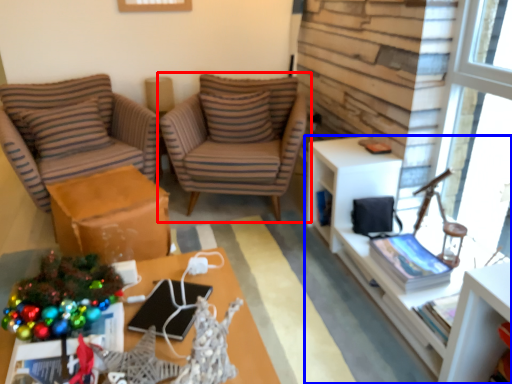
Question: Which object appears farthest to the camera in this image, chair (highlighted by a red box) or cabinetry (highlighted by a blue box)?

Choices:
 (A) chair
 (B) cabinetry

Answer: (A)